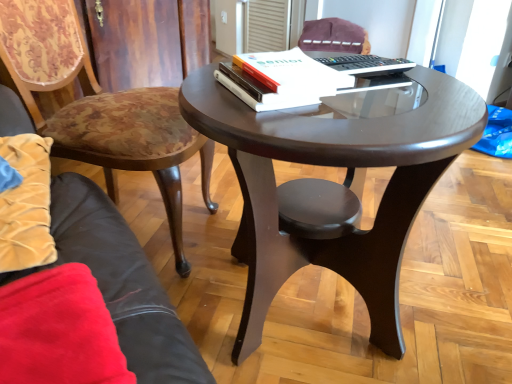
Question: From a real-world perspective, is white paper at upper center below white plastic remote control at upper center?

Choices:
 (A) no
 (B) yes

Answer: (A)

Question: Could white plastic remote control at upper center be considered to be inside white paper at upper center?

Choices:
 (A) no
 (B) yes

Answer: (A)

Question: From the image's perspective, is white paper at upper center located above white plastic remote control at upper center?

Choices:
 (A) yes
 (B) no

Answer: (B)

Question: Does white paper at upper center come in front of white plastic remote control at upper center?

Choices:
 (A) yes
 (B) no

Answer: (A)

Question: Can you confirm if white paper at upper center is thinner than white plastic remote control at upper center?

Choices:
 (A) yes
 (B) no

Answer: (A)

Question: Is white plastic remote control at upper center wider or thinner than velvet purple chair at upper center, which is the 1th chair in top-to-bottom order?

Choices:
 (A) thin
 (B) wide

Answer: (A)

Question: From a real-world perspective, is white plastic remote control at upper center physically located above or below velvet purple chair at upper center, which ranks as the second chair in front-to-back order?

Choices:
 (A) above
 (B) below

Answer: (A)

Question: Is white plastic remote control at upper center situated inside velvet purple chair at upper center, which is the 1th chair in top-to-bottom order, or outside?

Choices:
 (A) outside
 (B) inside

Answer: (A)

Question: From the image's perspective, is white plastic remote control at upper center above or below velvet purple chair at upper center, which ranks as the second chair in front-to-back order?

Choices:
 (A) above
 (B) below

Answer: (B)

Question: Based on their positions, is velvet purple chair at upper center, which ranks as the second chair in front-to-back order, located to the left or right of shiny dark wood coffee table at center?

Choices:
 (A) right
 (B) left

Answer: (A)

Question: Is velvet purple chair at upper center, the first chair when ordered from right to left, wider or thinner than shiny dark wood coffee table at center?

Choices:
 (A) wide
 (B) thin

Answer: (B)

Question: Looking at the image, does velvet purple chair at upper center, which ranks as the 1th chair in back-to-front order, seem bigger or smaller compared to shiny dark wood coffee table at center?

Choices:
 (A) big
 (B) small

Answer: (B)

Question: From a real-world perspective, relative to shiny dark wood coffee table at center, is velvet purple chair at upper center, which is the 1th chair in top-to-bottom order, vertically above or below?

Choices:
 (A) below
 (B) above

Answer: (B)

Question: From the image's perspective, is velvet floral chair at left, acting as the second chair starting from the top, above or below velvet purple chair at upper center, which is the 1th chair in top-to-bottom order?

Choices:
 (A) above
 (B) below

Answer: (B)

Question: Is velvet floral chair at left, which is the 1th chair in front-to-back order, in front of or behind velvet purple chair at upper center, which is counted as the 2th chair, starting from the bottom, in the image?

Choices:
 (A) behind
 (B) front

Answer: (B)